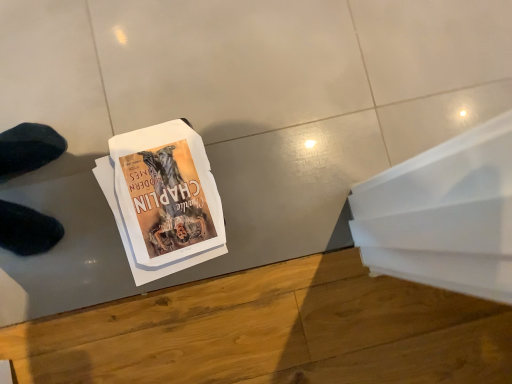
At what (x,y) coordinates should I click in order to perform the action: click on vacant area located to the right-hand side of matte paper book at center. Please return your answer as a coordinate pair (x, y). Image resolution: width=512 pixels, height=384 pixels. Looking at the image, I should click on (280, 204).